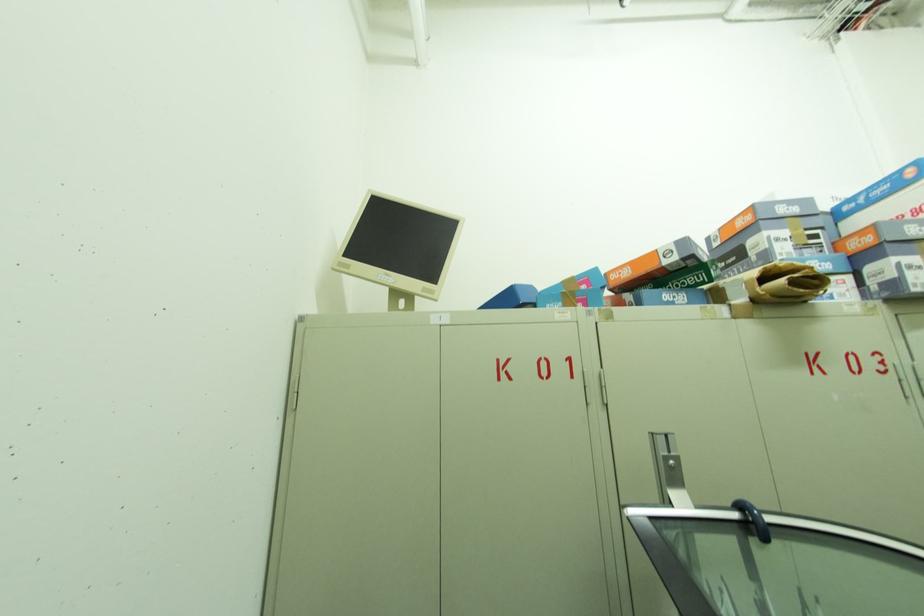
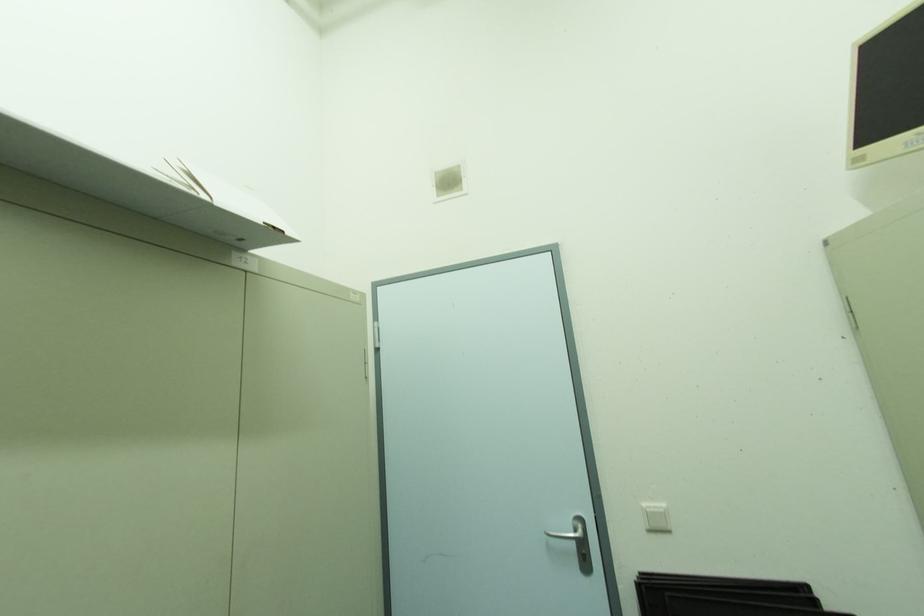
Question: The first image is from the beginning of the video and the second image is from the end. How did the camera likely rotate when shooting the video?

Choices:
 (A) Left
 (B) Right
 (C) Up
 (D) Down

Answer: (A)